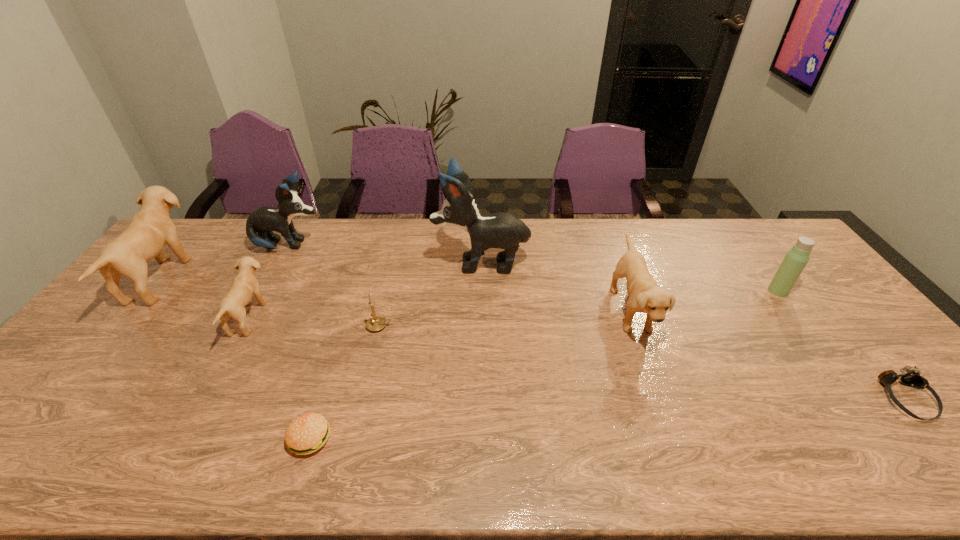
I want to click on object present at the near edge, so click(307, 433).

At what (x,y) coordinates should I click in order to perform the action: click on object present at the left edge. Please return your answer as a coordinate pair (x, y). This screenshot has height=540, width=960. Looking at the image, I should click on (151, 228).

Where is `thermos bottle at the right edge`? This screenshot has width=960, height=540. thermos bottle at the right edge is located at coordinates (794, 262).

Image resolution: width=960 pixels, height=540 pixels. I want to click on goggles that is at the right edge, so pos(911,378).

Find the location of a particular element. The height and width of the screenshot is (540, 960). object located in the far left corner section of the desktop is located at coordinates (151, 228).

Image resolution: width=960 pixels, height=540 pixels. In the image, there is a desktop. What are the coordinates of `free space at the far edge` in the screenshot? It's located at (704, 237).

Locate an element on the screen. This screenshot has height=540, width=960. vacant space at the near edge is located at coordinates (278, 441).

Locate an element on the screen. Image resolution: width=960 pixels, height=540 pixels. free space at the left edge of the desktop is located at coordinates (180, 282).

The height and width of the screenshot is (540, 960). What are the coordinates of `blank space at the right edge` in the screenshot? It's located at (893, 421).

This screenshot has height=540, width=960. Find the location of `free region at the far right corner`. free region at the far right corner is located at coordinates (759, 225).